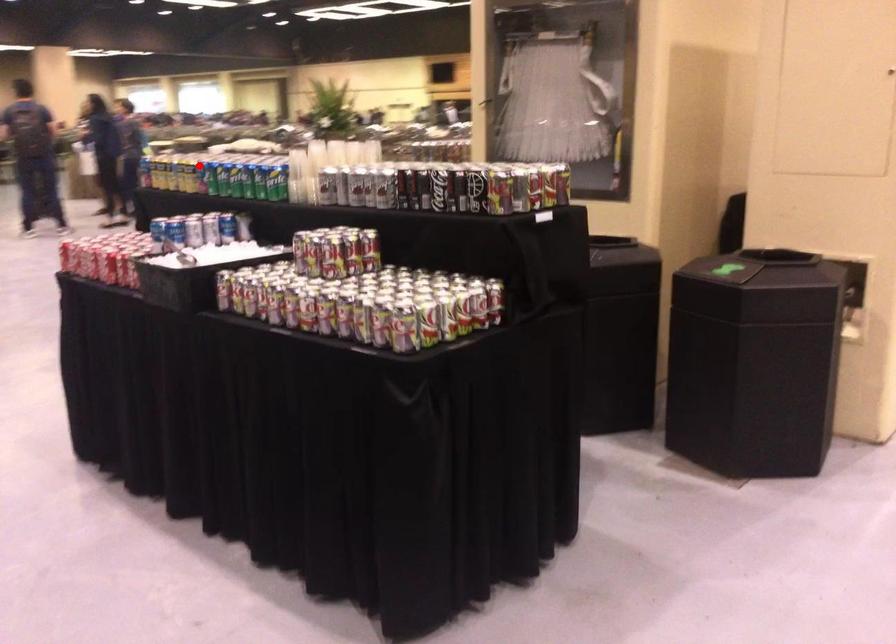
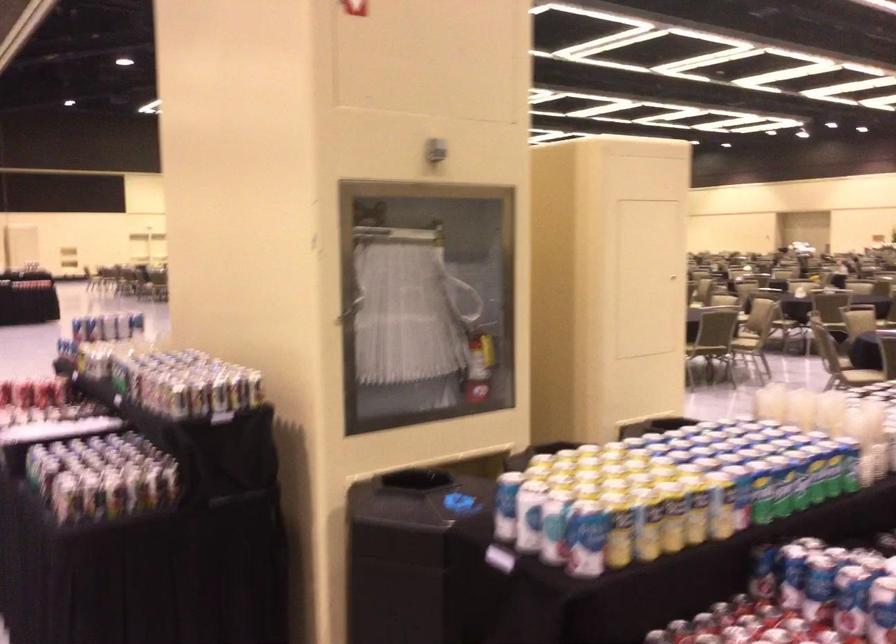
Find the pixel in the second image that matches the highlighted location in the first image.

(761, 491)